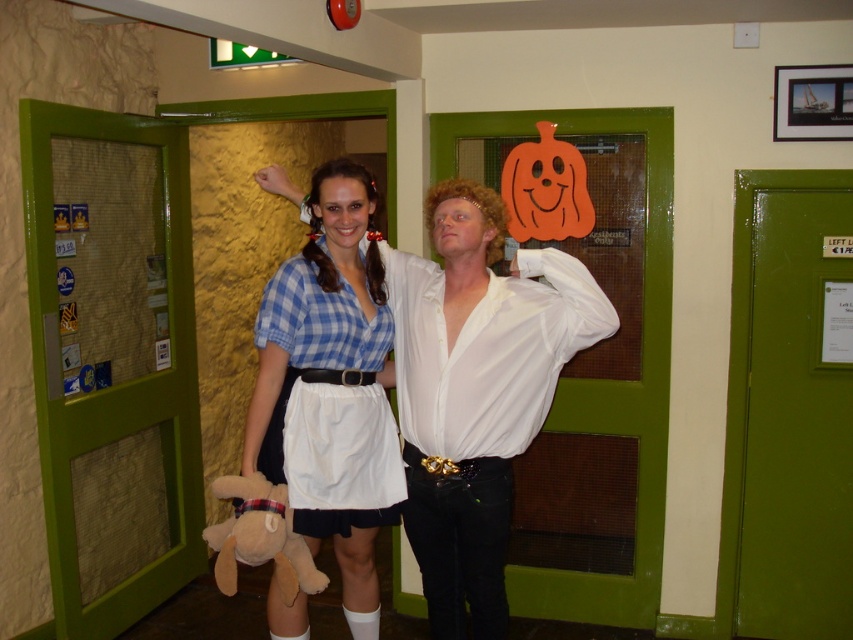
Question: Can you confirm if matte blue plaid shirt at center is positioned above blue checkered shirt at center?

Choices:
 (A) no
 (B) yes

Answer: (A)

Question: Does matte blue plaid shirt at center appear on the right side of blue checkered shirt at center?

Choices:
 (A) yes
 (B) no

Answer: (A)

Question: Does matte blue plaid shirt at center appear under blue checkered shirt at center?

Choices:
 (A) yes
 (B) no

Answer: (A)